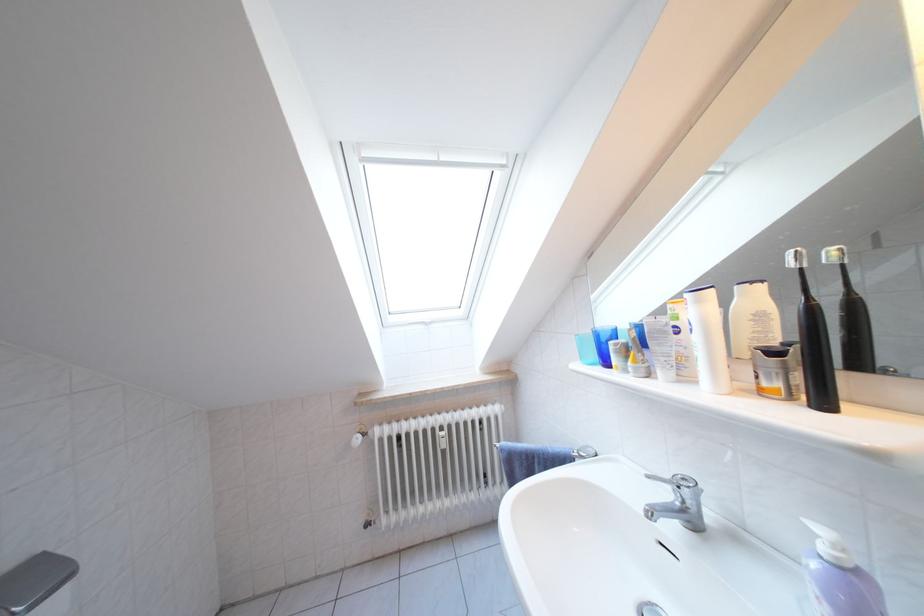
What do you see at coordinates (431, 317) in the screenshot? I see `the window blind handle` at bounding box center [431, 317].